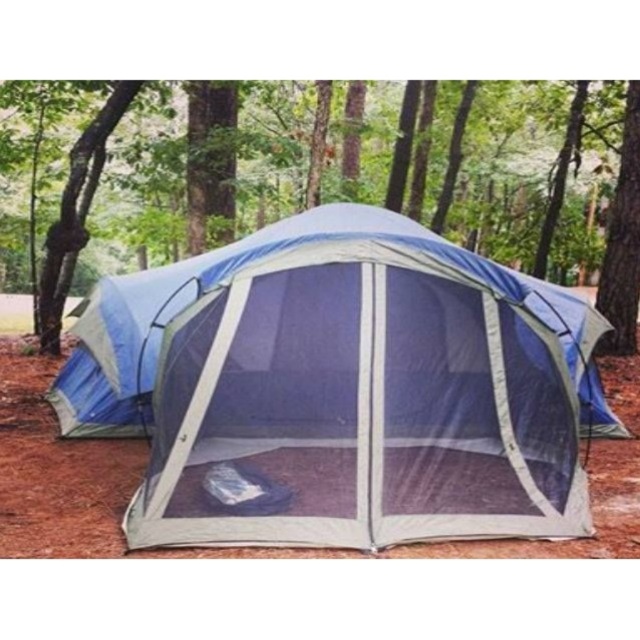
You are a camper who needs to set up a 2.5 meter long tent pole. You are standing at the blue mesh tent at center and want to place the pole horizontally towards the brown rough bark tree at right. Will the pole reach the tree without bending?

The distance between the blue mesh tent at center and the brown rough bark tree at right is 4.32 meters, which is longer than the 2.5 meter pole. Therefore, the pole will not reach the tree without bending.

You are planning to set up a camping gear organizer that requires 2 meters of space. You see the blue mesh tent at center and the brown rough bark tree at right. Which object provides enough space for the organizer?

The blue mesh tent at center has a larger size compared to the brown rough bark tree at right, so it can accommodate the 2 meters of space needed for the camping gear organizer.